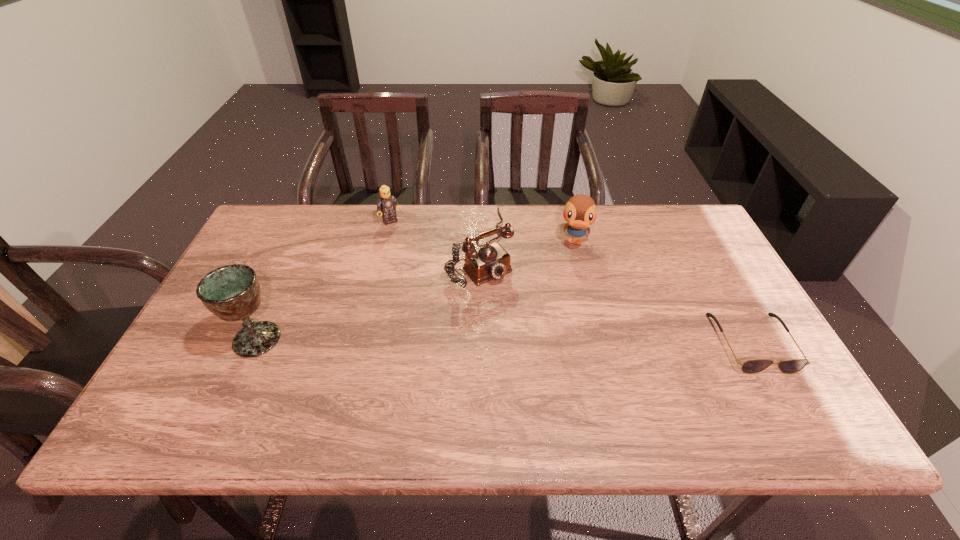
Where is `vacant space on the desktop that is between the leftmost object and the sunglasses and is positioned in front of the second object from left to right`? This screenshot has height=540, width=960. vacant space on the desktop that is between the leftmost object and the sunglasses and is positioned in front of the second object from left to right is located at coordinates (475, 341).

Find the location of a particular element. free space on the desktop that is between the leftmost object and the sunglasses and is positioned on the front-facing side of the second object from right to left is located at coordinates (567, 341).

Locate an element on the screen. This screenshot has width=960, height=540. vacant spot on the desktop that is between the leftmost object and the shortest object and is positioned on the dial of the third object from left to right is located at coordinates (565, 341).